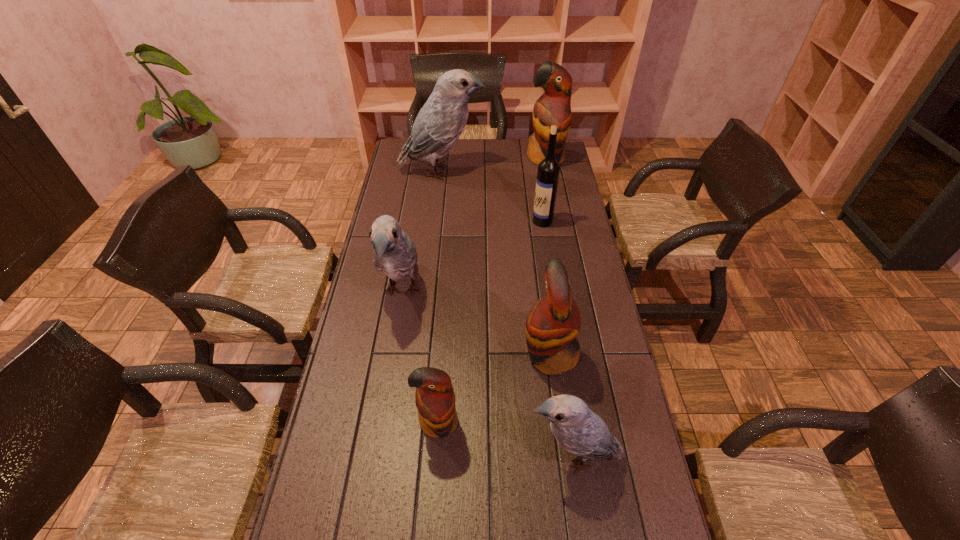
Where is `the smallest red parrot`? the smallest red parrot is located at coordinates (435, 399).

Identify the location of the leftmost red parrot. The image size is (960, 540). (435, 399).

I want to click on free region located 0.390m on the front-facing side of the farthest gray parrot, so click(x=571, y=172).

Identify the location of free spot located on the face of the farthest red parrot. (552, 193).

Where is `free region located on the label of the wine bottle`? Image resolution: width=960 pixels, height=540 pixels. free region located on the label of the wine bottle is located at coordinates (437, 221).

Find the location of a particular element. This screenshot has height=540, width=960. vacant space located on the label of the wine bottle is located at coordinates (484, 221).

I want to click on free point located 0.320m on the label of the wine bottle, so click(x=451, y=221).

Identify the location of free space located 0.400m on the face of the third nearest object. (388, 355).

Identify the location of free space located 0.250m on the face of the third nearest object. (438, 355).

Where is `free location located on the face of the third nearest object`? This screenshot has height=540, width=960. free location located on the face of the third nearest object is located at coordinates (468, 355).